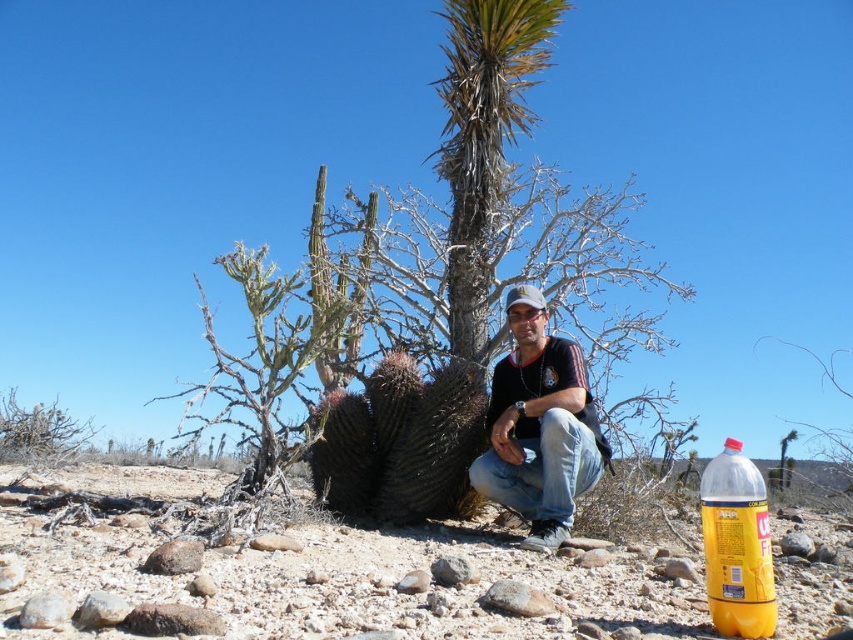
Question: Can you confirm if green leafy palm tree at center is smaller than black cotton shirt at center?

Choices:
 (A) yes
 (B) no

Answer: (B)

Question: Is green leafy palm tree at center below black cotton shirt at center?

Choices:
 (A) yes
 (B) no

Answer: (B)

Question: Which of the following is the closest to the observer?

Choices:
 (A) brown textured cactus at center
 (B) black cotton shirt at center
 (C) yellow translucent bottle at lower right

Answer: (A)

Question: Estimate the real-world distances between objects in this image. Which object is closer to the green leafy palm tree at center?

Choices:
 (A) black cotton shirt at center
 (B) yellow translucent bottle at lower right
 (C) brown textured cactus at center

Answer: (A)

Question: Is brown textured cactus at center wider than black cotton shirt at center?

Choices:
 (A) no
 (B) yes

Answer: (B)

Question: Considering the real-world distances, which object is closest to the brown textured cactus at center?

Choices:
 (A) black cotton shirt at center
 (B) green leafy palm tree at center

Answer: (A)